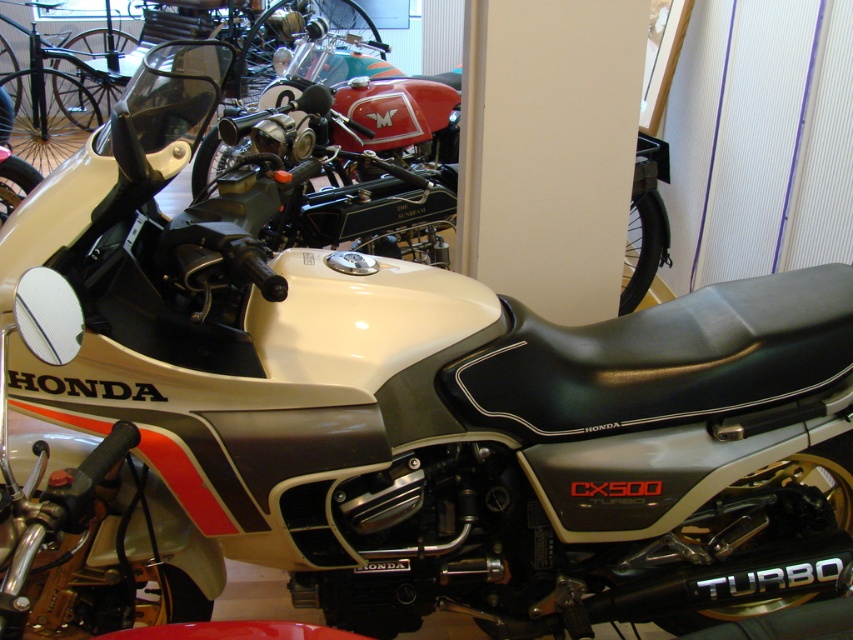
Question: Does white matte pillar at center have a greater width compared to matte black motorcycle at center?

Choices:
 (A) no
 (B) yes

Answer: (A)

Question: Which point is farther from the camera taking this photo?

Choices:
 (A) (332, 90)
 (B) (621, 132)

Answer: (A)

Question: Is white matte pillar at center further to camera compared to matte black motorcycle at center?

Choices:
 (A) yes
 (B) no

Answer: (A)

Question: Does white matte pillar at center appear over matte black motorcycle at center?

Choices:
 (A) yes
 (B) no

Answer: (B)

Question: Which point appears closest to the camera in this image?

Choices:
 (A) (498, 188)
 (B) (204, 180)

Answer: (A)